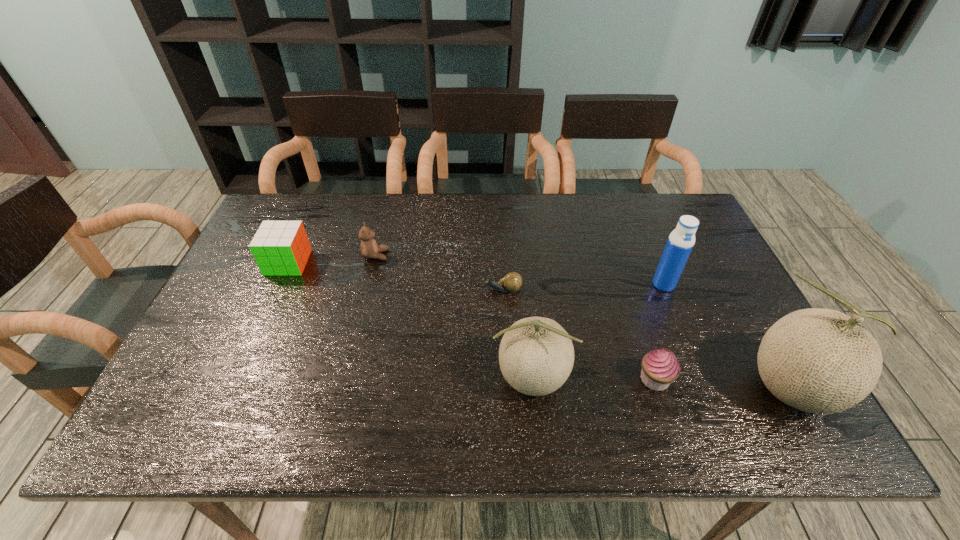
This screenshot has width=960, height=540. Identify the location of blank area in the image that satisfies the following two spatial constraints: 1. on the front-facing side of the tallest object; 2. on the left side of the escargot. (506, 388).

I want to click on free space that satisfies the following two spatial constraints: 1. on the front-facing side of the teddy bear; 2. on the right side of the third object from right to left, so click(345, 380).

Where is `free space that satisfies the following two spatial constraints: 1. on the front side of the third object from right to left; 2. on the left side of the tallest object`? free space that satisfies the following two spatial constraints: 1. on the front side of the third object from right to left; 2. on the left side of the tallest object is located at coordinates (658, 388).

Identify the location of vacant position in the image that satisfies the following two spatial constraints: 1. on the front-facing side of the shortest object; 2. on the back side of the right cantaloup. This screenshot has height=540, width=960. point(506,388).